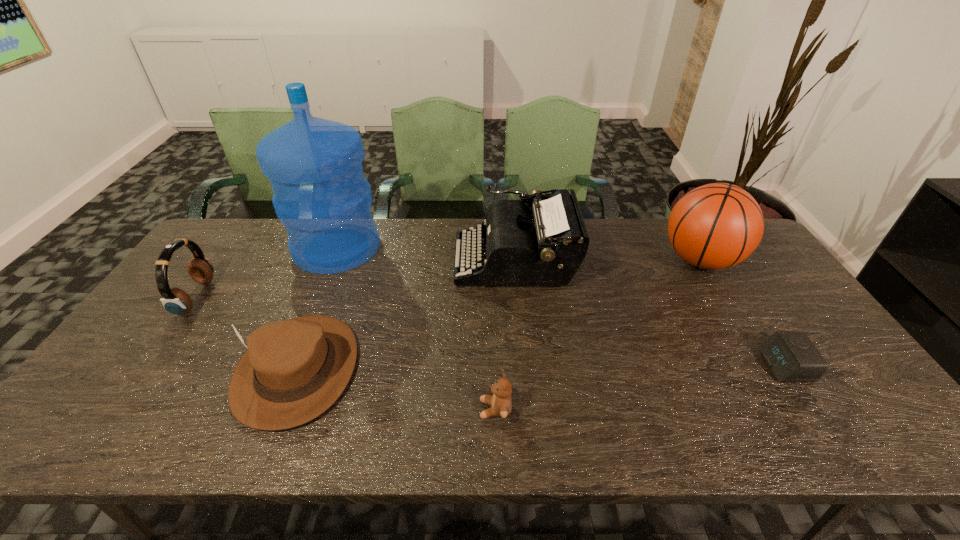
The height and width of the screenshot is (540, 960). In order to click on basketball that is at the far edge in this screenshot , I will do `click(715, 226)`.

Where is `typewriter that is at the far edge`? typewriter that is at the far edge is located at coordinates (543, 246).

Find the location of `fedora that is at the near edge`. fedora that is at the near edge is located at coordinates (293, 370).

Where is `teddy bear positioned at the near edge`? teddy bear positioned at the near edge is located at coordinates (501, 404).

The width and height of the screenshot is (960, 540). Identify the location of object at the left edge. (176, 301).

Identify the location of basketball at the right edge. (715, 226).

The height and width of the screenshot is (540, 960). I want to click on alarm clock present at the right edge, so click(791, 355).

Where is `object that is at the far right corner`? object that is at the far right corner is located at coordinates (715, 226).

In the image, there is a desktop. Where is `free space at the far edge`? free space at the far edge is located at coordinates coord(406,230).

In the image, there is a desktop. Where is `vacant space at the near edge`? The image size is (960, 540). vacant space at the near edge is located at coordinates (532, 433).